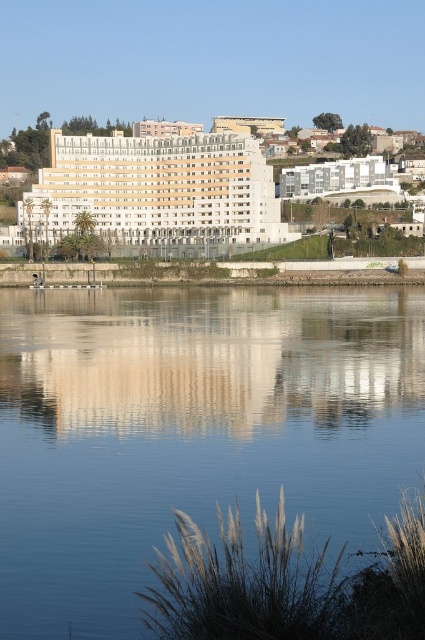
Which of these two, blue glassy water at center or white smooth building at center, stands shorter?

With less height is white smooth building at center.

Is blue glassy water at center closer to camera compared to white smooth building at center?

That is True.

What do you see at coordinates (192, 429) in the screenshot? I see `blue glassy water at center` at bounding box center [192, 429].

Where is `blue glassy water at center`? The height and width of the screenshot is (640, 425). blue glassy water at center is located at coordinates (192, 429).